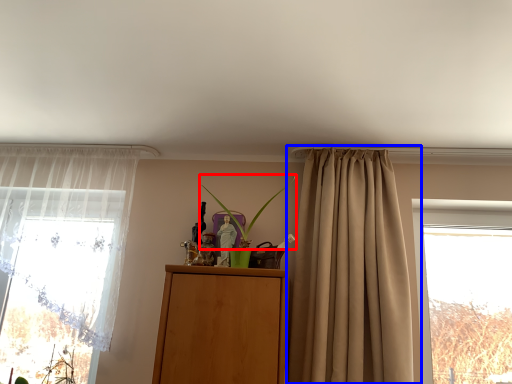
Question: Which point is further to the camera, plant (highlighted by a red box) or curtain (highlighted by a blue box)?

Choices:
 (A) plant
 (B) curtain

Answer: (A)